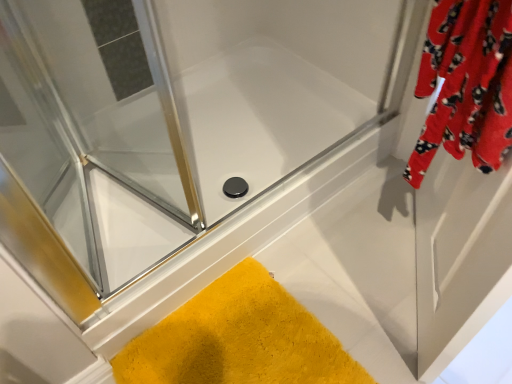
Question: Is point (446, 238) closer or farther from the camera than point (159, 137)?

Choices:
 (A) farther
 (B) closer

Answer: (B)

Question: In terms of height, does velvet red robe at upper right, positioned as the 2th screen door in left-to-right order, look taller or shorter compared to transparent glass shower door at upper left, which is the 2th screen door from right to left?

Choices:
 (A) short
 (B) tall

Answer: (B)

Question: Which object is positioned closest to the yellow fuzzy bath mat at lower left?

Choices:
 (A) transparent glass shower door at upper left, the first screen door positioned from the left
 (B) velvet red robe at upper right, which appears as the 1th screen door when viewed from the right

Answer: (B)

Question: Which object is the closest to the transparent glass shower door at upper left, the first screen door positioned from the left?

Choices:
 (A) yellow fuzzy bath mat at lower left
 (B) velvet red robe at upper right, positioned as the 2th screen door in left-to-right order

Answer: (A)